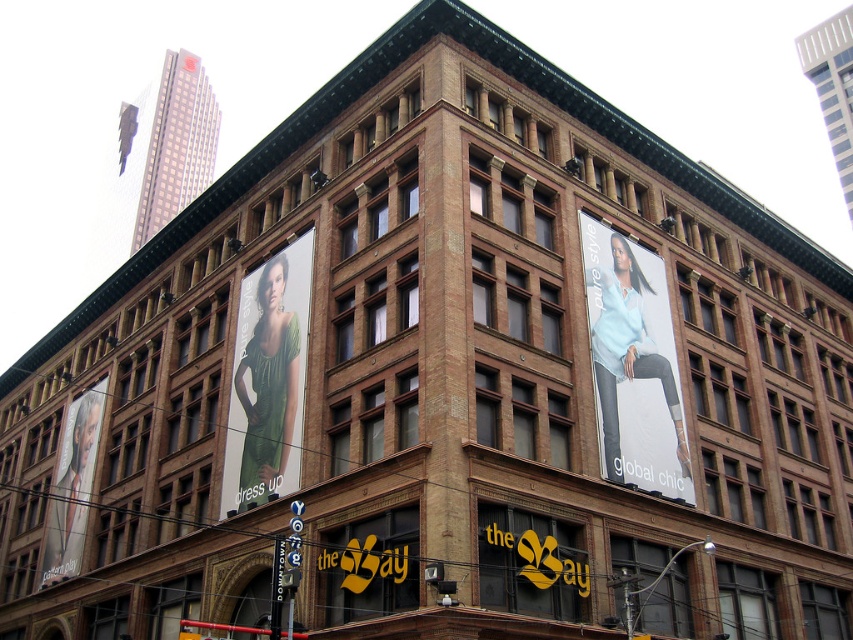
What do you see at coordinates (633, 364) in the screenshot? This screenshot has width=853, height=640. I see `light blue fabric at upper right` at bounding box center [633, 364].

Can you confirm if light blue fabric at upper right is taller than matte black portrait at left?

Correct, light blue fabric at upper right is much taller as matte black portrait at left.

Between point (648, 269) and point (77, 486), which one is positioned in front?

Positioned in front is point (648, 269).

Locate an element on the screen. The height and width of the screenshot is (640, 853). light blue fabric at upper right is located at coordinates (633, 364).

Between green fabric dress at left and matte black portrait at left, which one is positioned lower?

Positioned lower is matte black portrait at left.

Measure the distance between green fabric dress at left and matte black portrait at left.

A distance of 22.71 meters exists between green fabric dress at left and matte black portrait at left.

Locate an element on the screen. green fabric dress at left is located at coordinates (268, 380).

Which is in front, point (654, 259) or point (296, 368)?

Point (296, 368)

Is point (589, 300) more distant than point (270, 316)?

No, it is not.

Where is `light blue fabric at upper right`? The image size is (853, 640). light blue fabric at upper right is located at coordinates [x=633, y=364].